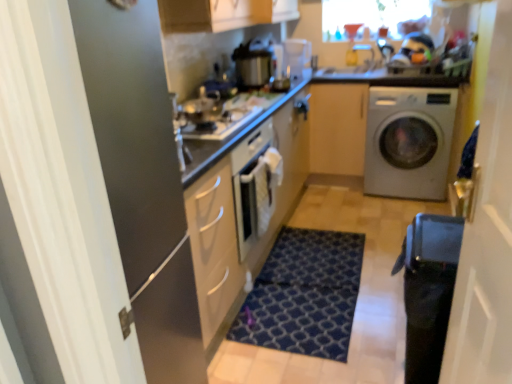
Question: Is matte wood cabinet at center thinner than transparent plastic screen door at right, the 2th screen door from the left?

Choices:
 (A) no
 (B) yes

Answer: (A)

Question: Is matte wood cabinet at center turned away from transparent plastic screen door at right, marked as the first screen door in a right-to-left arrangement?

Choices:
 (A) yes
 (B) no

Answer: (B)

Question: Can we say matte wood cabinet at center lies outside transparent plastic screen door at right, the 2th screen door from the left?

Choices:
 (A) yes
 (B) no

Answer: (A)

Question: Is matte wood cabinet at center oriented towards transparent plastic screen door at right, the 2th screen door from the left?

Choices:
 (A) no
 (B) yes

Answer: (B)

Question: From the image's perspective, is matte wood cabinet at center on top of transparent plastic screen door at right, the 2th screen door from the left?

Choices:
 (A) no
 (B) yes

Answer: (B)

Question: Considering the relative positions of matte wood cabinet at center and transparent plastic screen door at right, the 2th screen door from the left, in the image provided, is matte wood cabinet at center to the right of transparent plastic screen door at right, the 2th screen door from the left, from the viewer's perspective?

Choices:
 (A) no
 (B) yes

Answer: (B)

Question: Can you confirm if satin silver washing machine at right is positioned to the right of white glossy countertop at upper center?

Choices:
 (A) no
 (B) yes

Answer: (B)

Question: Is satin silver washing machine at right smaller than white glossy countertop at upper center?

Choices:
 (A) no
 (B) yes

Answer: (A)

Question: Does satin silver washing machine at right have a greater height compared to white glossy countertop at upper center?

Choices:
 (A) no
 (B) yes

Answer: (B)

Question: Is satin silver washing machine at right oriented towards white glossy countertop at upper center?

Choices:
 (A) yes
 (B) no

Answer: (B)

Question: From a real-world perspective, is satin silver washing machine at right located higher than white glossy countertop at upper center?

Choices:
 (A) no
 (B) yes

Answer: (A)

Question: Does satin silver washing machine at right contain white glossy countertop at upper center?

Choices:
 (A) yes
 (B) no

Answer: (A)

Question: Is metallic silver pot at center closer to the viewer compared to black glossy water heater at lower right?

Choices:
 (A) yes
 (B) no

Answer: (B)